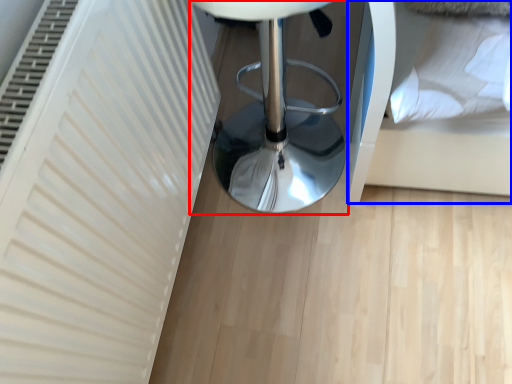
Question: Which of the following is the farthest to the observer, furniture (highlighted by a red box) or bed (highlighted by a blue box)?

Choices:
 (A) furniture
 (B) bed

Answer: (B)